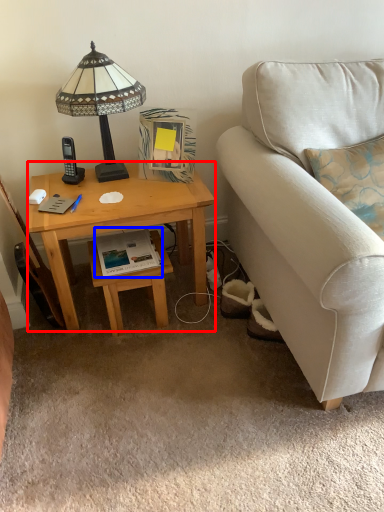
Question: Which point is closer to the camera, desk (highlighted by a red box) or book (highlighted by a blue box)?

Choices:
 (A) desk
 (B) book

Answer: (A)